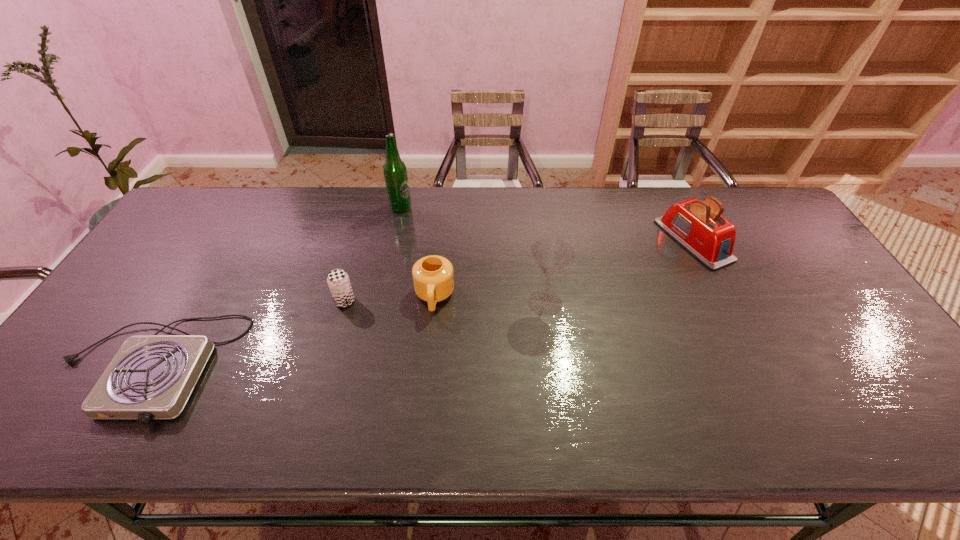
Locate an element on the screen. The image size is (960, 540). vacant area that satisfies the following two spatial constraints: 1. on the label of the tallest object; 2. on the left side of the toaster is located at coordinates (394, 240).

At what (x,y) coordinates should I click in order to perform the action: click on free location that satisfies the following two spatial constraints: 1. on the handle side of the third object from right to left; 2. on the left side of the fifth object from left to right. Please return your answer as a coordinate pair (x, y). Looking at the image, I should click on (434, 303).